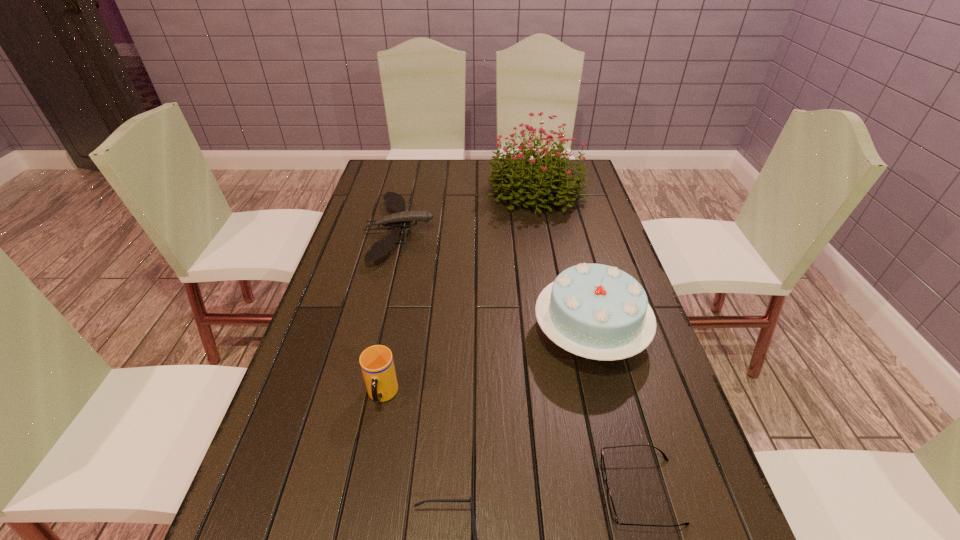
Select which object is the fifth closest to the cup. Please provide its 2D coordinates. Your answer should be formatted as a tuple, i.e. [(x, y)], where the tuple contains the x and y coordinates of a point satisfying the conditions above.

[(550, 175)]

Where is `the closest object to the fourth shortest object`? The image size is (960, 540). the closest object to the fourth shortest object is located at coordinates (475, 539).